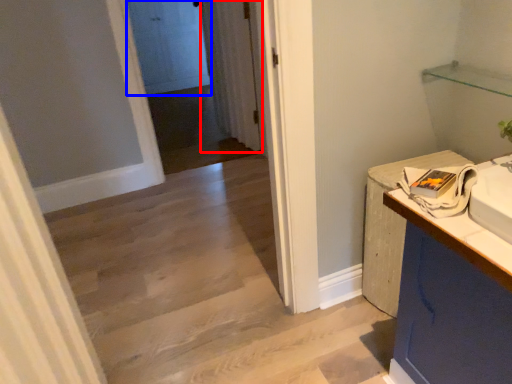
Question: Which point is further to the camera, curtain (highlighted by a red box) or door (highlighted by a blue box)?

Choices:
 (A) curtain
 (B) door

Answer: (B)